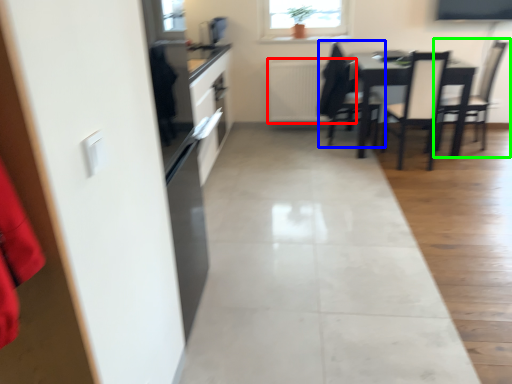
Question: Considering the real-world distances, which object is farthest from radiator (highlighted by a red box)? chair (highlighted by a blue box) or chair (highlighted by a green box)?

Choices:
 (A) chair
 (B) chair

Answer: (B)